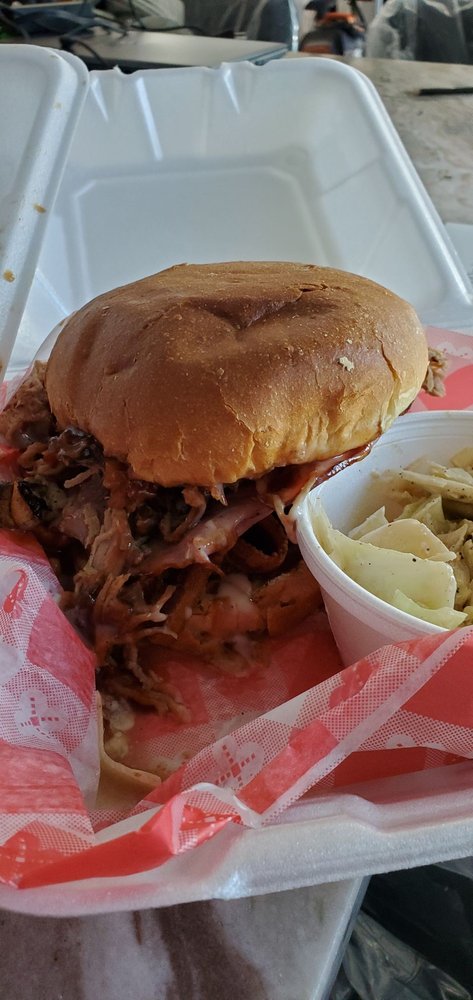
This screenshot has width=473, height=1000. I want to click on laptop, so click(163, 48).